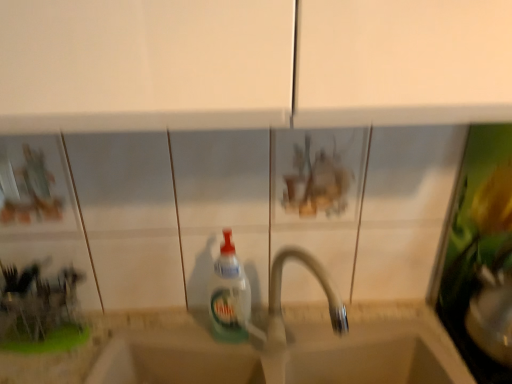
Where is `unoccupied space behind white plastic tap at center`? unoccupied space behind white plastic tap at center is located at coordinates (309, 336).